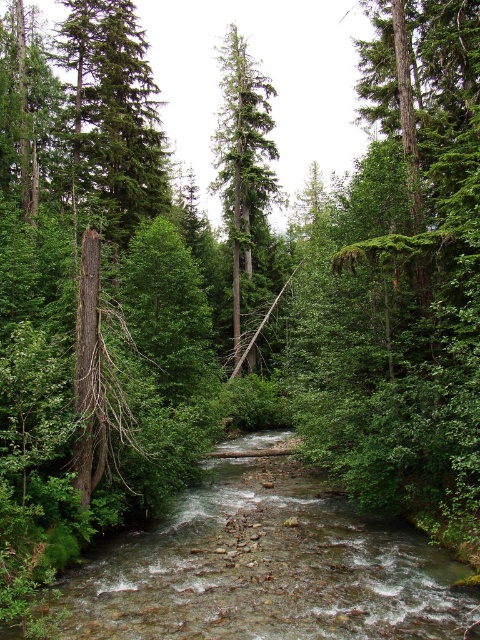
You are a hiker trying to determine the tallest tree in the forest scene. You see the green matte tree at left and the green matte tree at center. Which tree is taller?

The green matte tree at center is taller than the green matte tree at left.

You are a hiker standing at the edge of the forest and see the clear water at stream center and the green matte tree at left. Which object is positioned more to the right side of the scene?

The clear water at stream center is positioned more to the right side of the scene compared to the green matte tree at left.

You are standing at the edge of the forest stream and want to reach a specific point marked at coordinates point [141,212]. If your maximum comfortable walking distance is 30 meters, can you comfortably walk to that point without needing to rest?

The distance of point [141,212] from viewer is 28.98 meters, so yes, you can comfortably walk to that point without needing to rest since it is within your 30 meters limit.